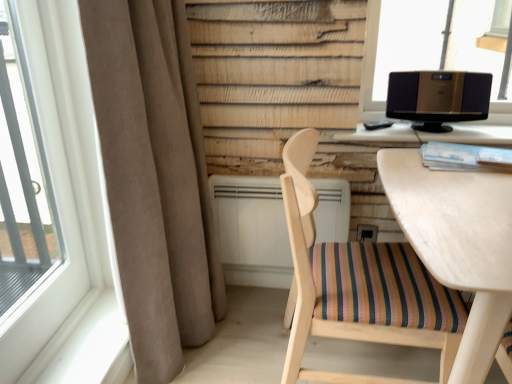
Question: In the image, is transparent glass window at upper right, marked as the second window in a left-to-right arrangement, on the left side or the right side of white plastic air conditioner at center?

Choices:
 (A) right
 (B) left

Answer: (A)

Question: In the image, is transparent glass window at upper right, acting as the first window starting from the right, positioned in front of or behind white plastic air conditioner at center?

Choices:
 (A) front
 (B) behind

Answer: (A)

Question: Estimate the real-world distances between objects in this image. Which object is closer to the beige fabric curtain at left?

Choices:
 (A) metallic silver speaker at upper right
 (B) black glossy monitor at upper right
 (C) white plastic air conditioner at center
 (D) transparent glass window at upper right, marked as the second window in a left-to-right arrangement
 (E) white plastic window at left, acting as the 2th window starting from the back

Answer: (E)

Question: Based on their relative distances, which object is nearer to the wooden chair with striped cushion at center?

Choices:
 (A) wooden table at right
 (B) transparent glass window at upper right, which is the 1th window from back to front
 (C) beige fabric curtain at left
 (D) white plastic air conditioner at center
 (E) metallic silver speaker at upper right

Answer: (A)